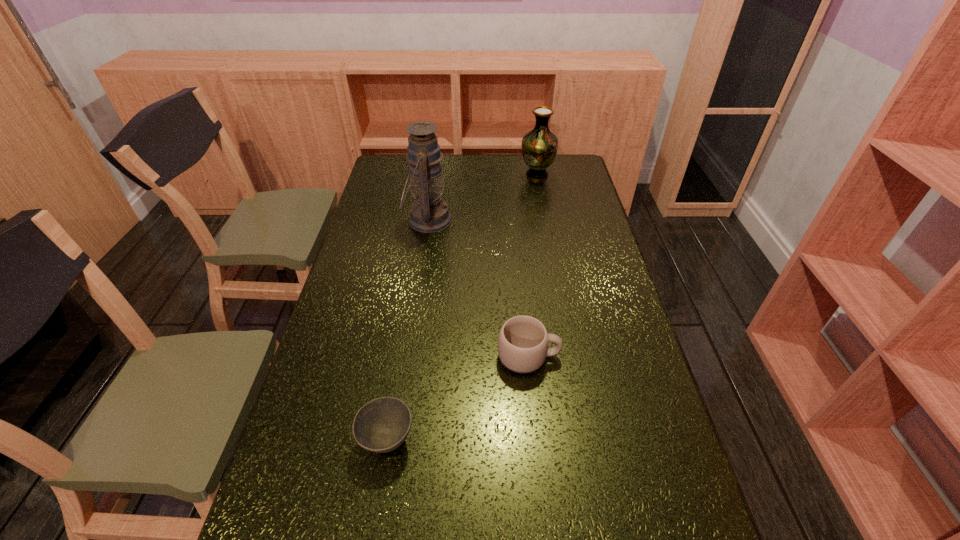
Find the location of a particular element. This screenshot has height=540, width=960. empty location between the nearest object and the oil lamp is located at coordinates (407, 330).

You are a GUI agent. You are given a task and a screenshot of the screen. Output one action in this format:
    pyautogui.click(x=<x>, y=<y>)
    Task: Click on the empty space that is in between the farthest object and the shortest object
    Image resolution: width=960 pixels, height=540 pixels.
    Given the screenshot: What is the action you would take?
    pyautogui.click(x=462, y=308)

Where is `free space between the vase and the nearest object`? The width and height of the screenshot is (960, 540). free space between the vase and the nearest object is located at coordinates (462, 308).

Locate an element on the screen. The image size is (960, 540). vacant area between the tallest object and the nearest object is located at coordinates (407, 330).

Find the location of `free space between the tallest object and the nearest object`. free space between the tallest object and the nearest object is located at coordinates (407, 330).

Locate an element on the screen. This screenshot has height=540, width=960. empty location between the shortest object and the tallest object is located at coordinates (407, 330).

The width and height of the screenshot is (960, 540). Find the location of `free area in between the oil lamp and the shortest object`. free area in between the oil lamp and the shortest object is located at coordinates (407, 330).

Where is `vacant area that lies between the bowl and the oil lamp`? This screenshot has width=960, height=540. vacant area that lies between the bowl and the oil lamp is located at coordinates (407, 330).

Where is `blank region between the second shortest object and the farthest object`? blank region between the second shortest object and the farthest object is located at coordinates (533, 266).

The image size is (960, 540). I want to click on vacant area that lies between the mug and the vase, so click(533, 266).